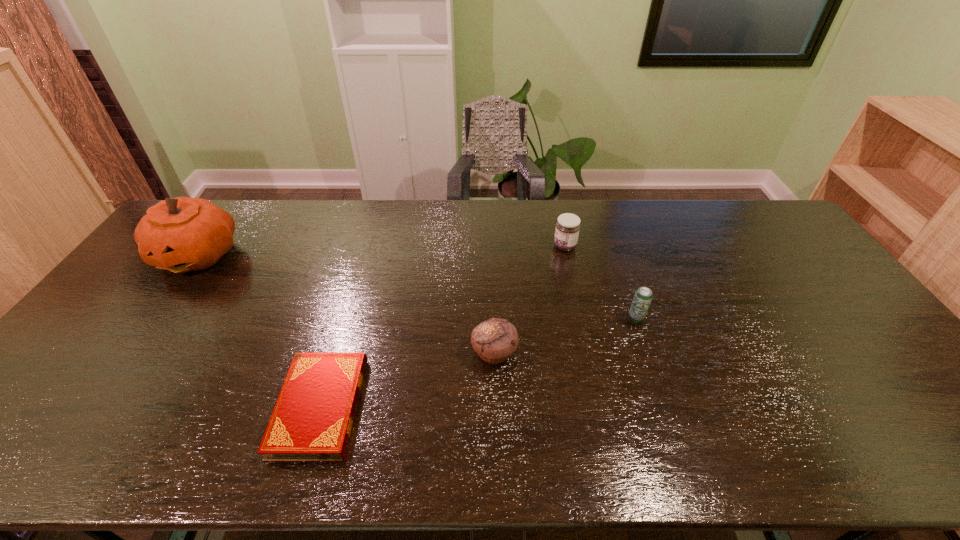
Find the location of a particular element. free area in between the tallest object and the muffin is located at coordinates (347, 304).

Find the location of a particular element. Image resolution: width=960 pixels, height=540 pixels. free space between the rightmost object and the pumpkin is located at coordinates (417, 287).

The image size is (960, 540). I want to click on vacant space that's between the rightmost object and the muffin, so click(x=564, y=336).

Locate an element on the screen. This screenshot has width=960, height=540. free spot between the jam and the pumpkin is located at coordinates (382, 251).

Where is `vacant region between the third object from right to left and the beer can`? vacant region between the third object from right to left and the beer can is located at coordinates (564, 336).

Identify which object is located as the third nearest to the third nearest object. Please provide its 2D coordinates. Your answer should be formatted as a tuple, i.e. [(x, y)], where the tuple contains the x and y coordinates of a point satisfying the conditions above.

[(312, 420)]

Choose which object is the nearest neighbor to the shortest object. Please provide its 2D coordinates. Your answer should be formatted as a tuple, i.e. [(x, y)], where the tuple contains the x and y coordinates of a point satisfying the conditions above.

[(495, 339)]

Find the location of a particular element. The height and width of the screenshot is (540, 960). free point that satisfies the following two spatial constraints: 1. on the front label of the rightmost object; 2. on the left side of the fourth object from left to right is located at coordinates (581, 319).

The height and width of the screenshot is (540, 960). What are the coordinates of `free space that satisfies the following two spatial constraints: 1. on the front-facing side of the leftmost object; 2. on the left side of the rightmost object` in the screenshot? It's located at (152, 319).

Where is `free location that satisfies the following two spatial constraints: 1. on the front-facing side of the pumpkin; 2. on the left side of the muffin`? free location that satisfies the following two spatial constraints: 1. on the front-facing side of the pumpkin; 2. on the left side of the muffin is located at coordinates (127, 354).